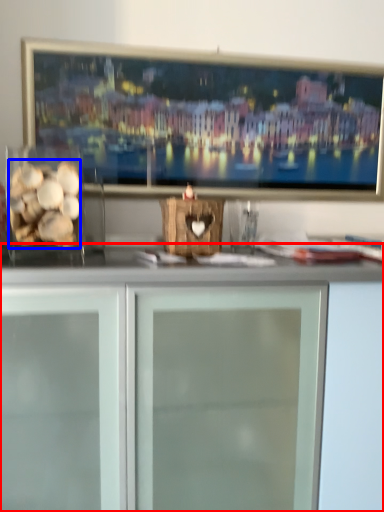
Question: Which object is further to the camera taking this photo, cabinetry (highlighted by a red box) or food (highlighted by a blue box)?

Choices:
 (A) cabinetry
 (B) food

Answer: (B)